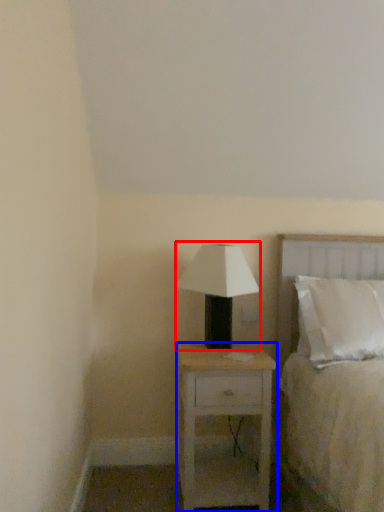
Question: Which object is closer to the camera taking this photo, table lamp (highlighted by a red box) or nightstand (highlighted by a blue box)?

Choices:
 (A) table lamp
 (B) nightstand

Answer: (B)